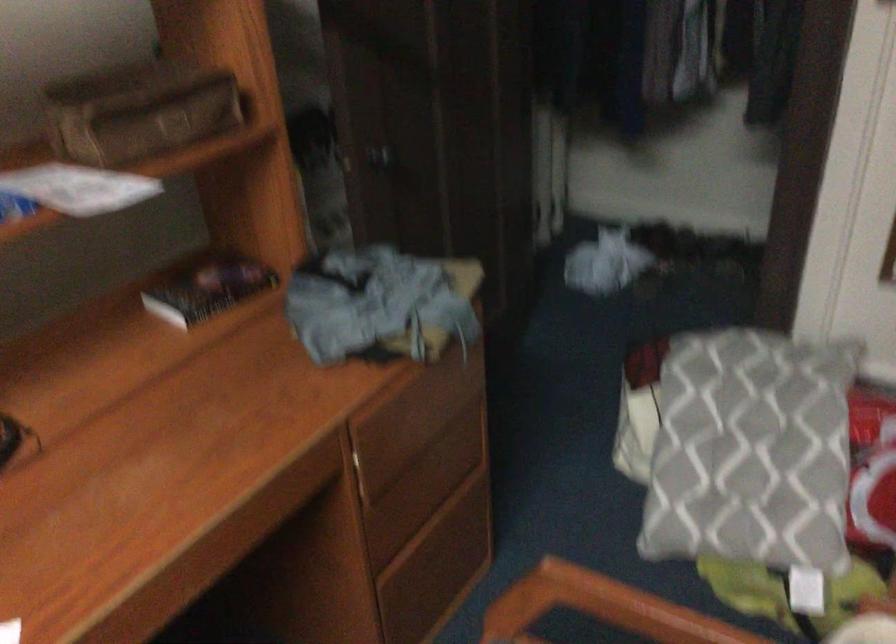
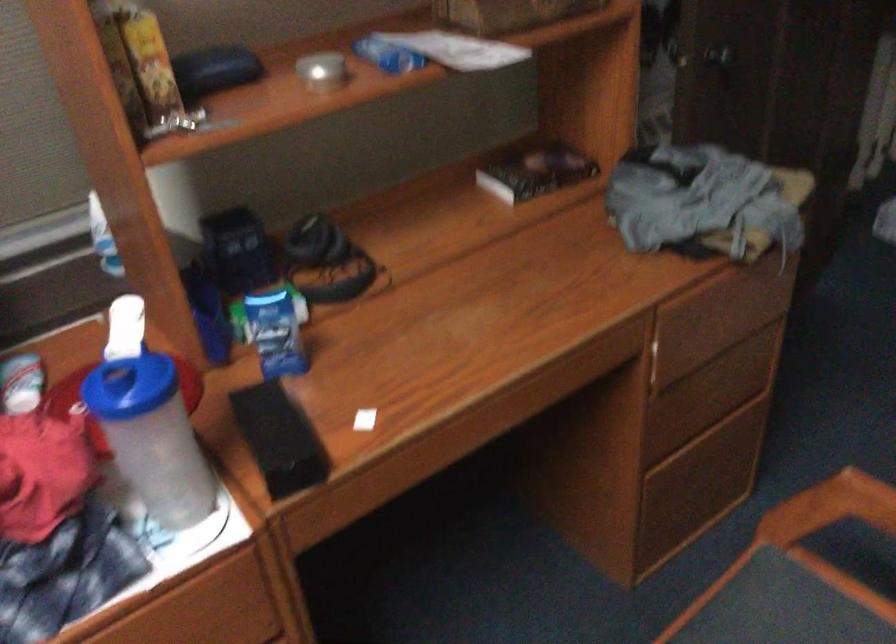
The point at [376,154] is marked in the first image. Where is the corresponding point in the second image?

(718, 55)